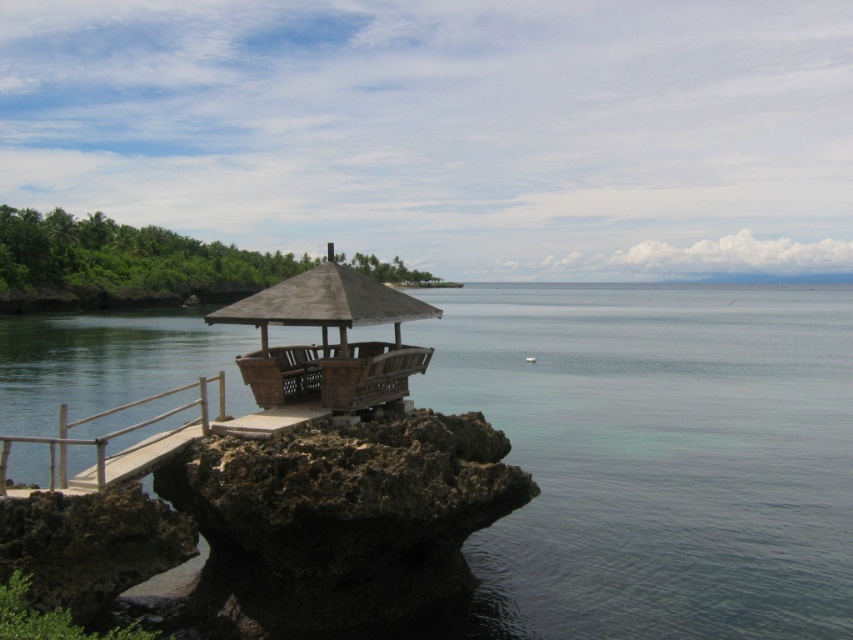
From the picture: Does wooden gazebo at center have a lesser height compared to white wood rail at lower left?

Incorrect, wooden gazebo at center's height does not fall short of white wood rail at lower left's.

Is point (381, 285) in front of point (143, 468)?

No, it is not.

Locate an element on the screen. wooden gazebo at center is located at coordinates (328, 339).

Does clear blue water at center have a lesser height compared to wooden gazebo at center?

No.

Measure the distance between point (x=799, y=362) and camera.

Point (x=799, y=362) and camera are 41.45 meters apart from each other.

The image size is (853, 640). What are the coordinates of `clear blue water at center` in the screenshot? It's located at (654, 458).

Find the location of `clear blue water at center`. clear blue water at center is located at coordinates tap(654, 458).

Can you confirm if clear blue water at center is taller than white wood rail at lower left?

Yes, clear blue water at center is taller than white wood rail at lower left.

Who is shorter, clear blue water at center or white wood rail at lower left?

white wood rail at lower left is shorter.

The width and height of the screenshot is (853, 640). Describe the element at coordinates (654, 458) in the screenshot. I see `clear blue water at center` at that location.

This screenshot has width=853, height=640. What are the coordinates of `clear blue water at center` in the screenshot? It's located at (654, 458).